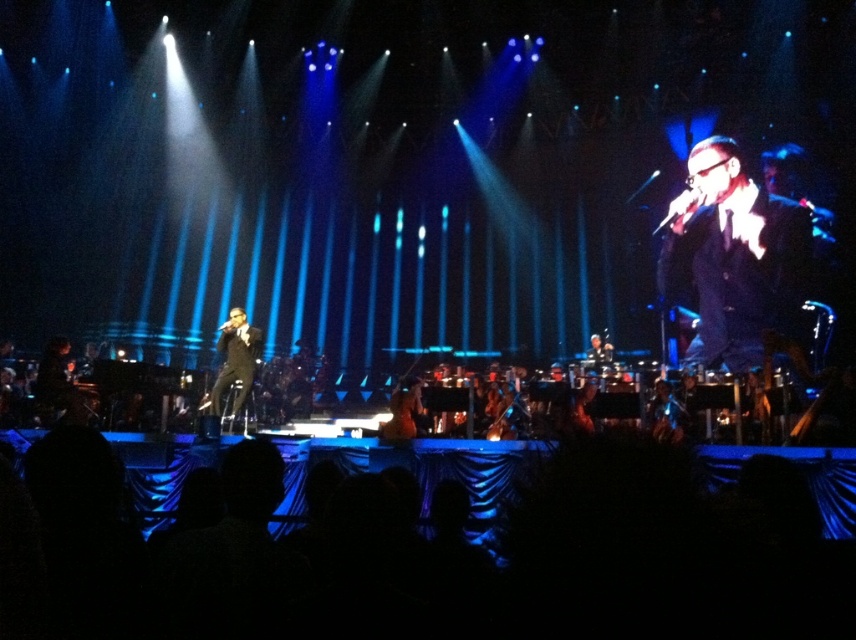
You are a photographer at the back of the venue. You need to capture a clear photo of both the black glossy suit at center and the black glossy suit at left. Which performer should you adjust your camera focus on first to ensure their suit appears sharper in the photo?

The black glossy suit at center has a lesser width compared to black glossy suit at left, so you should focus on the black glossy suit at left first since it is closer to you and will require less adjustment to achieve sharpness.

Looking at this image, you are a photographer at the back of the venue. You want to capture a photo where both the black glossy suit at center and the black glossy suit at left are clearly visible. Which performer should you focus on first to ensure their position in the frame?

The black glossy suit at center is located above the black glossy suit at left, so you should focus on the black glossy suit at center first to ensure it is positioned higher in the frame while still capturing the black glossy suit at left below it.

You are a stagehand positioned at the center of the stage. You need to move a heavy equipment cart from your current position to the point marked by point (758, 301) and then to point (211, 392). Considering the layout of the stage described, which path would require moving closer to the audience area? Explain your reasoning based on their positions.

Moving from the center to point (211, 392) would require moving closer to the audience area because point (211, 392) is in front of point (758, 301). Since the stagehand starts at the center, going to the closer point first would mean moving towards the front of the stage, which is typically where the audience is located.